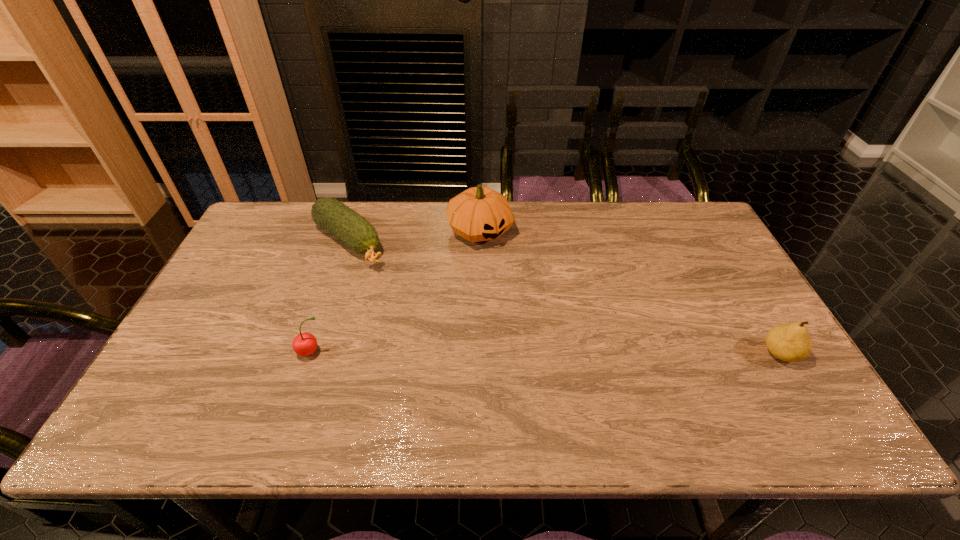
The height and width of the screenshot is (540, 960). Find the location of `vacant space located 0.060m at the blossom end of the cucumber`. vacant space located 0.060m at the blossom end of the cucumber is located at coordinates (383, 275).

Identify the location of vacant area situated at the blossom end of the cucumber. This screenshot has width=960, height=540. (395, 285).

The height and width of the screenshot is (540, 960). I want to click on vacant space situated at the blossom end of the cucumber, so click(415, 301).

I want to click on gourd present at the far edge, so click(479, 213).

You are a GUI agent. You are given a task and a screenshot of the screen. Output one action in this format:
    pyautogui.click(x=<x>, y=<y>)
    Task: Click on the cucumber that is positioned at the far edge
    This screenshot has height=540, width=960.
    Given the screenshot: What is the action you would take?
    pyautogui.click(x=354, y=230)

Where is `object that is at the near edge`? Image resolution: width=960 pixels, height=540 pixels. object that is at the near edge is located at coordinates (789, 342).

At what (x,y) coordinates should I click in order to perform the action: click on object located in the right edge section of the desktop. Please return your answer as a coordinate pair (x, y). The image size is (960, 540). Looking at the image, I should click on (789, 342).

Find the location of a particular element. The height and width of the screenshot is (540, 960). object at the near right corner is located at coordinates (789, 342).

Image resolution: width=960 pixels, height=540 pixels. In the image, there is a desktop. In order to click on free space at the far edge in this screenshot , I will do `click(389, 238)`.

Locate an element on the screen. The height and width of the screenshot is (540, 960). free spot at the near edge of the desktop is located at coordinates (546, 395).